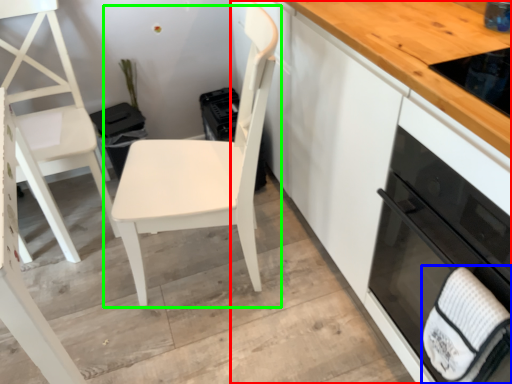
Question: Estimate the real-world distances between objects in this image. Which object is closer to cabinetry (highlighted by a red box), hand towel (highlighted by a blue box) or chair (highlighted by a green box)?

Choices:
 (A) hand towel
 (B) chair

Answer: (B)